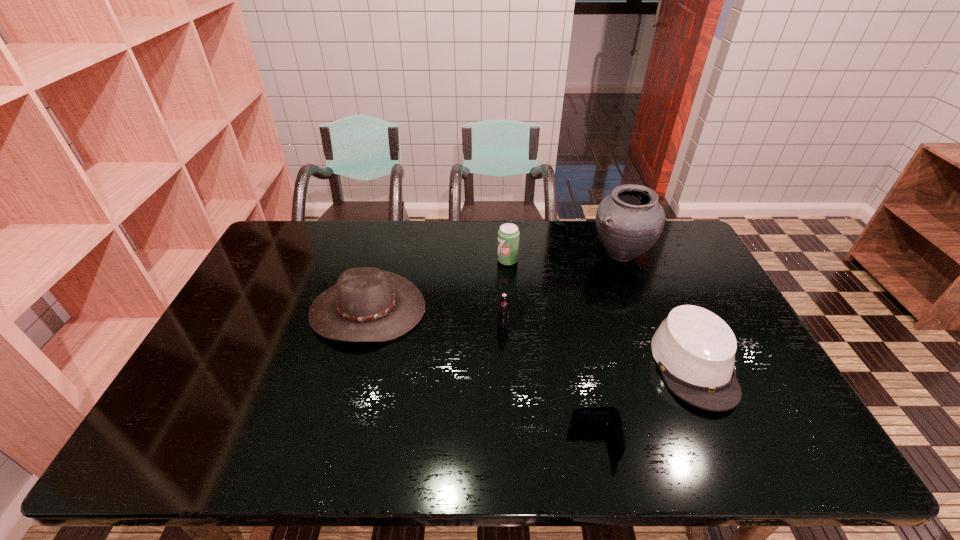
Locate an element on the screen. This screenshot has width=960, height=540. free region at the far edge is located at coordinates (406, 225).

This screenshot has height=540, width=960. I want to click on vacant space at the near edge, so click(x=479, y=434).

Find the location of a particular element. The image size is (960, 540). free space at the left edge of the desktop is located at coordinates (299, 276).

Find the location of `free space at the right edge of the desktop`. free space at the right edge of the desktop is located at coordinates (673, 299).

Image resolution: width=960 pixels, height=540 pixels. Identify the location of free space at the far right corner of the desktop. (655, 259).

Identify the location of free point between the farther pop and the shorter hat. (601, 313).

This screenshot has height=540, width=960. What are the coordinates of `free spot between the right hat and the urn` in the screenshot? It's located at (657, 310).

You are a GUI agent. You are given a task and a screenshot of the screen. Output one action in this format:
    pyautogui.click(x=<x>, y=<y>)
    Task: Click on the vacant space in between the third object from right to left and the shorter pop
    The height and width of the screenshot is (540, 960).
    Given the screenshot: What is the action you would take?
    pyautogui.click(x=549, y=383)

Find the location of a particular element. The image size is (960, 540). empty location between the left hat and the shortest object is located at coordinates [481, 376].

The height and width of the screenshot is (540, 960). I want to click on free space between the leftmost object and the tallest object, so click(x=494, y=282).